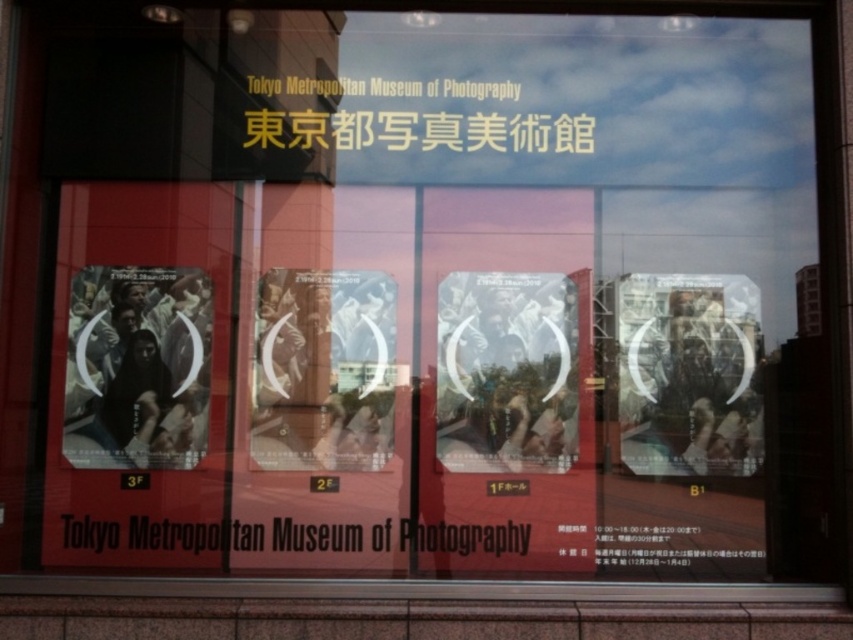
How far apart are matte black poster at right and matte paper poster at center?

The distance of matte black poster at right from matte paper poster at center is 14.24 inches.

Is matte black poster at right below matte paper poster at center?

Indeed, matte black poster at right is positioned under matte paper poster at center.

Identify the location of matte black poster at right. The width and height of the screenshot is (853, 640). (688, 372).

Can you confirm if matte black poster at right is wider than matte paper poster at lower left?

Yes.

Who is more forward, (721, 298) or (193, 417)?

Point (193, 417)

Is point (712, 368) more distant than point (193, 420)?

Yes, it is.

Where is `matte black poster at right`? matte black poster at right is located at coordinates (688, 372).

Is matte paper poster at lower left thinner than matte paper poster at center?

Yes.

Is matte paper poster at lower left to the right of matte paper poster at center from the viewer's perspective?

Incorrect, matte paper poster at lower left is not on the right side of matte paper poster at center.

Who is more distant from viewer, [126,372] or [498,404]?

Point [498,404]

Identify the location of matte paper poster at lower left. (137, 368).